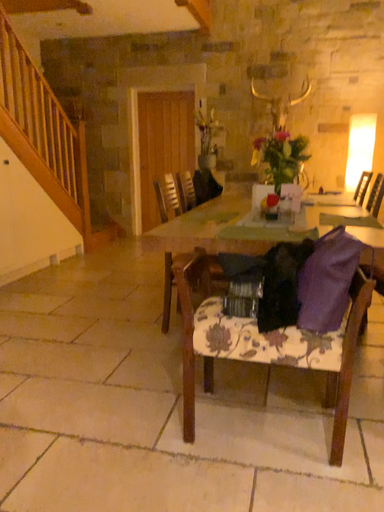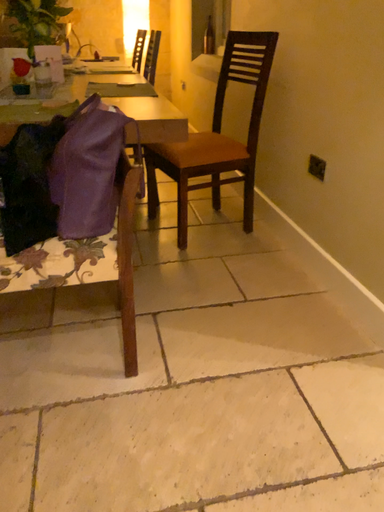
Question: Which way did the camera rotate in the video?

Choices:
 (A) rotated upward
 (B) rotated downward

Answer: (B)